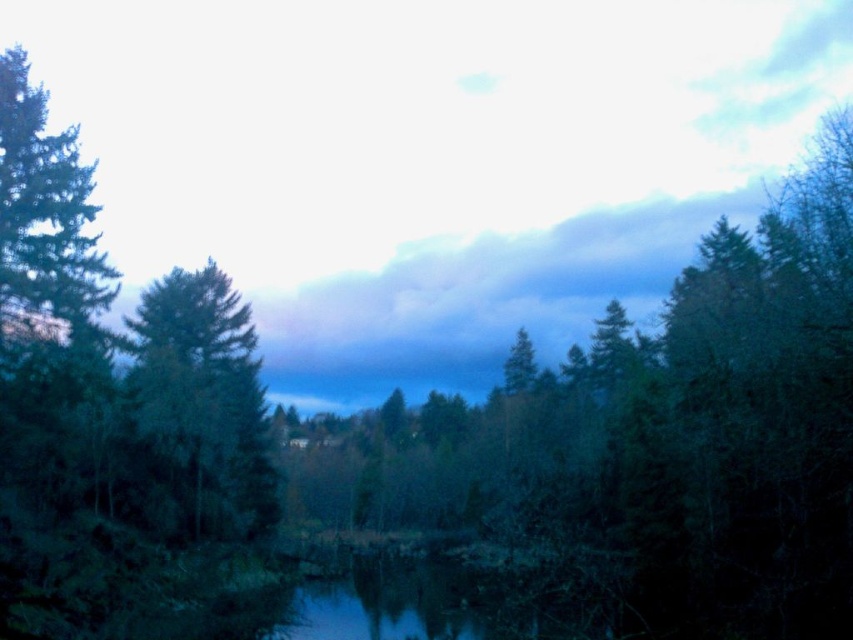
Question: Which object appears farthest from the camera in this image?

Choices:
 (A) green matte tree at left
 (B) green matte tree at center

Answer: (A)

Question: Which point is farther to the camera?

Choices:
 (A) (184, 385)
 (B) (755, 488)

Answer: (A)

Question: From the image, what is the correct spatial relationship of green matte tree at center in relation to green matte tree at left?

Choices:
 (A) left
 (B) right

Answer: (B)

Question: Does green matte tree at center appear under green matte tree at left?

Choices:
 (A) yes
 (B) no

Answer: (A)

Question: Can you confirm if green matte tree at center is bigger than green matte tree at left?

Choices:
 (A) yes
 (B) no

Answer: (A)

Question: Which of the following is the closest to the observer?

Choices:
 (A) (137, 384)
 (B) (836, 556)

Answer: (B)